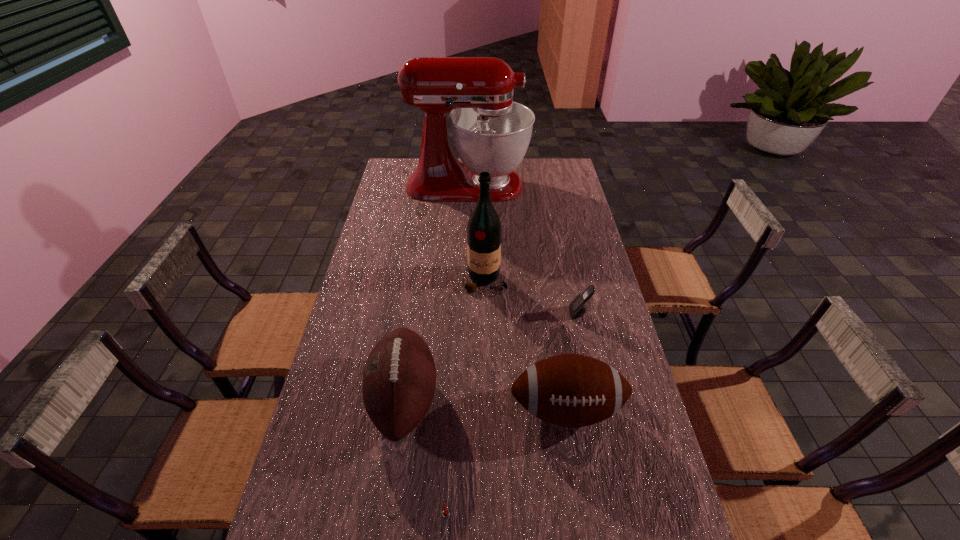
Image resolution: width=960 pixels, height=540 pixels. Find the location of `free space between the left football and the fifth shortest object`. free space between the left football and the fifth shortest object is located at coordinates (445, 340).

Find the location of a particular element. free space that is in between the left football and the third farthest object is located at coordinates (492, 356).

This screenshot has height=540, width=960. What are the coordinates of `the fourth closest object to the wine bottle` in the screenshot? It's located at (491, 133).

Locate an element on the screen. The image size is (960, 540). object that is the second closest to the nearest object is located at coordinates (571, 390).